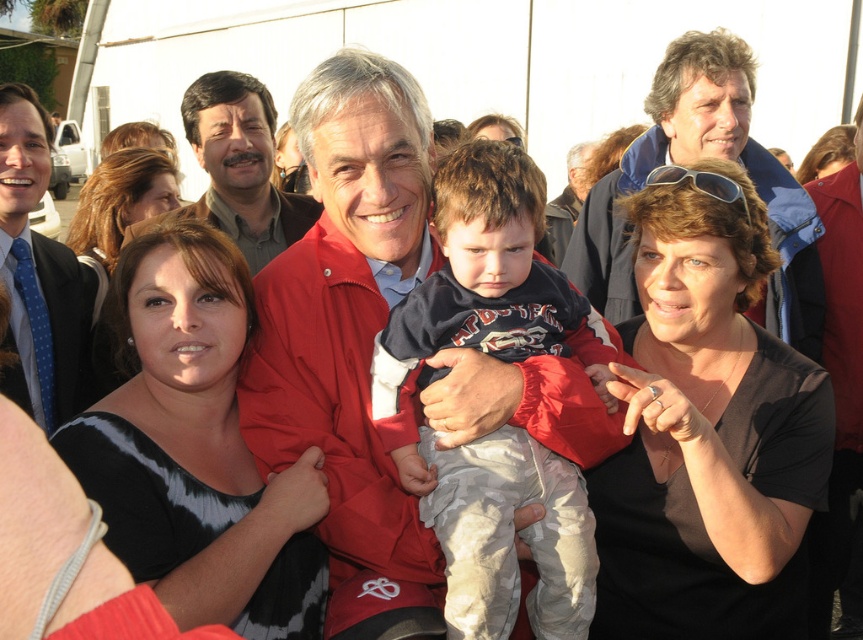
Image resolution: width=863 pixels, height=640 pixels. In order to click on black matte shirt at center in this screenshot , I will do `click(707, 435)`.

Locate an element on the screen. The image size is (863, 640). black matte shirt at center is located at coordinates 707,435.

Does black matte shirt at center have a smaller size compared to black satin dress at center?

Incorrect, black matte shirt at center is not smaller in size than black satin dress at center.

Is black matte shirt at center thinner than black satin dress at center?

Yes.

Describe the element at coordinates (707, 435) in the screenshot. I see `black matte shirt at center` at that location.

Locate an element on the screen. This screenshot has width=863, height=640. black matte shirt at center is located at coordinates (707, 435).

Does black satin dress at center have a lesser height compared to blue denim jacket at upper right?

Indeed, black satin dress at center has a lesser height compared to blue denim jacket at upper right.

In the scene shown: Who is taller, black satin dress at center or blue denim jacket at upper right?

blue denim jacket at upper right is taller.

You are a GUI agent. You are given a task and a screenshot of the screen. Output one action in this format:
    pyautogui.click(x=<x>, y=<y>)
    Task: Click on the black satin dress at center
    The width and height of the screenshot is (863, 640).
    Given the screenshot: What is the action you would take?
    pyautogui.click(x=196, y=448)

Identify the location of black satin dress at center. (196, 448).